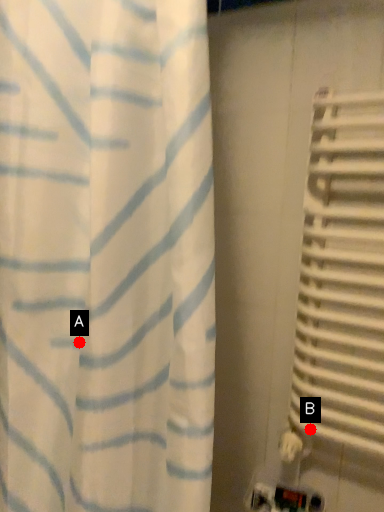
Question: Two points are circled on the image, labeled by A and B beside each circle. Among these points, which one is nearest to the camera?

Choices:
 (A) A is closer
 (B) B is closer

Answer: (A)